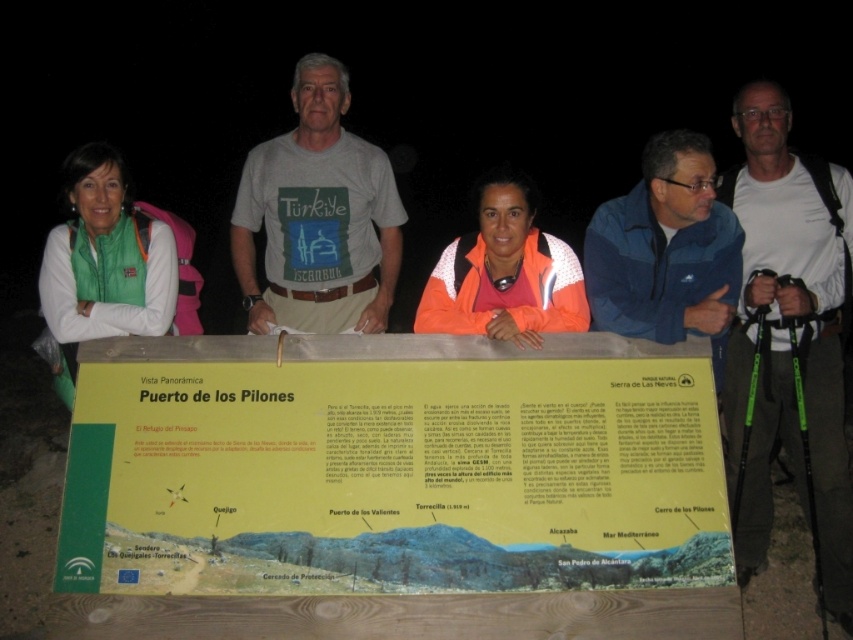
You are a photographer trying to capture a group photo of the green fleece jacket at left and the orange fleece jacket at center. Which jacket should you focus on first if you want to ensure both are in frame and properly sized?

The green fleece jacket at left is bigger than the orange fleece jacket at center, so focus on the green fleece jacket at left first to ensure proper framing for both.